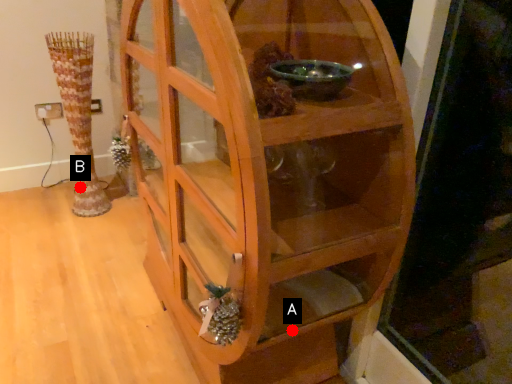
Question: Two points are circled on the image, labeled by A and B beside each circle. Which of the following is the closest to the observer?

Choices:
 (A) A is closer
 (B) B is closer

Answer: (A)